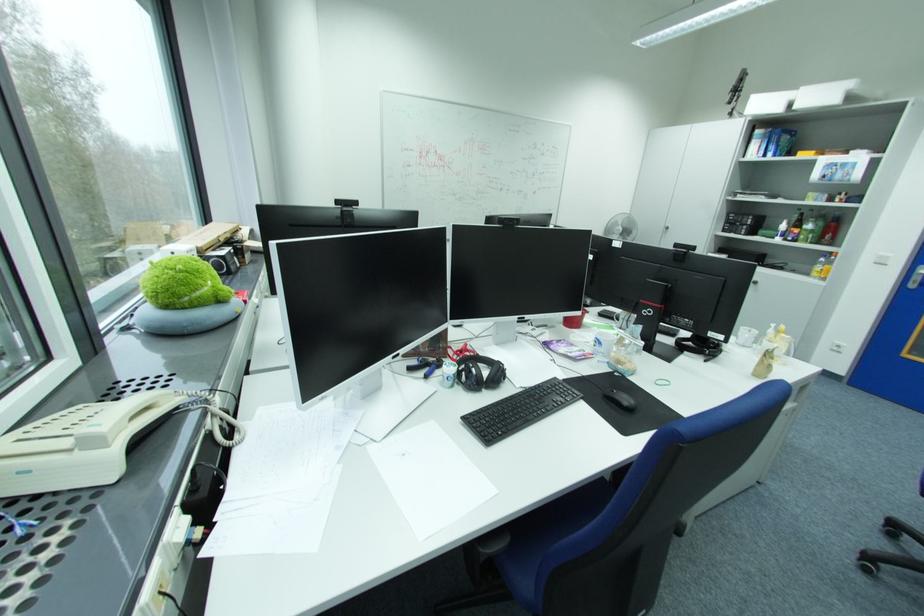
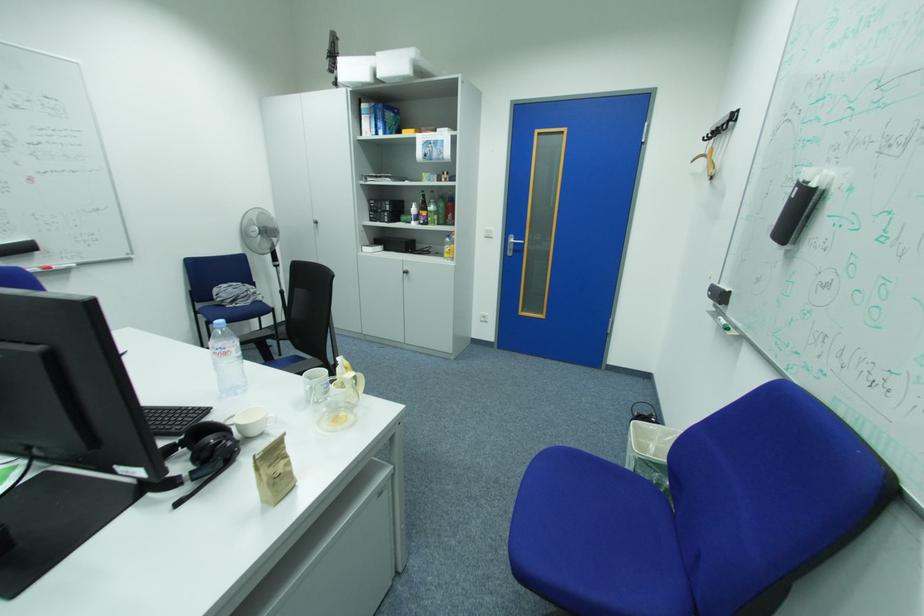
The point at (793,227) is marked in the first image. Where is the corresponding point in the second image?

(422, 211)